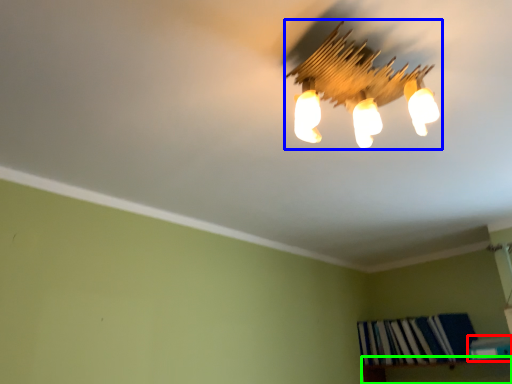
Question: Which object is the farthest from book (highlighted by a red box)? Choose among these: lamp (highlighted by a blue box) or shelf (highlighted by a green box).

Choices:
 (A) lamp
 (B) shelf

Answer: (A)